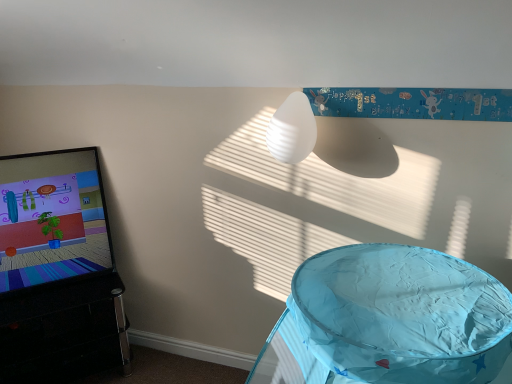
Question: In terms of height, does blue fabric play tent at lower right, the 1th furniture viewed from the front, look taller or shorter compared to matte black screen at left?

Choices:
 (A) short
 (B) tall

Answer: (B)

Question: Considering the positions of blue fabric play tent at lower right, positioned as the second furniture in left-to-right order, and matte black screen at left in the image, is blue fabric play tent at lower right, positioned as the second furniture in left-to-right order, wider or thinner than matte black screen at left?

Choices:
 (A) wide
 (B) thin

Answer: (A)

Question: Which is farther from the white ribbed lampshade at upper center?

Choices:
 (A) matte black screen at left
 (B) blue fabric play tent at lower right, the 1th furniture viewed from the front
 (C) black glossy tv stand at left, which ranks as the 2th furniture in front-to-back order

Answer: (C)

Question: Which object is positioned closest to the white ribbed lampshade at upper center?

Choices:
 (A) black glossy tv stand at left, placed as the second furniture when sorted from right to left
 (B) blue fabric play tent at lower right, the 1th furniture viewed from the front
 (C) matte black screen at left

Answer: (B)